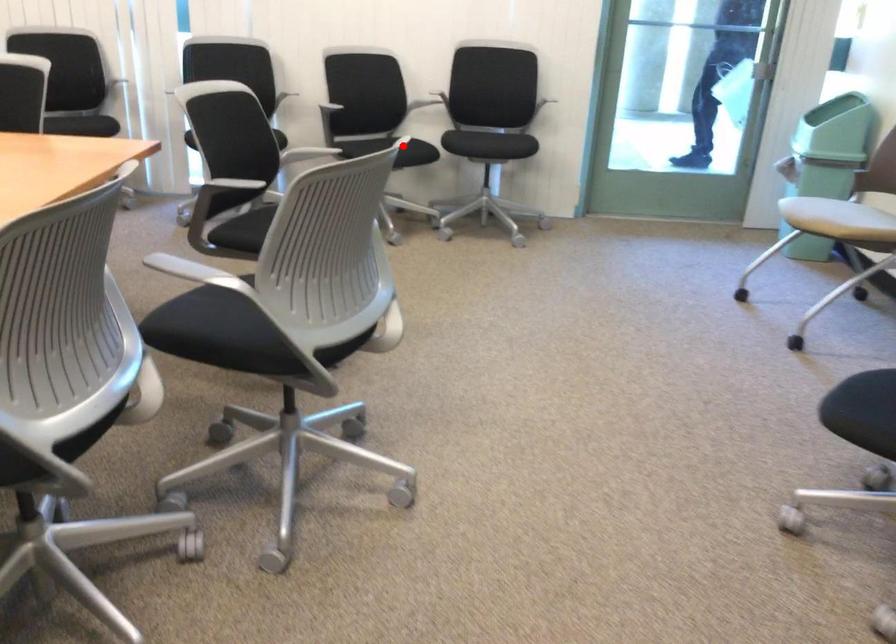
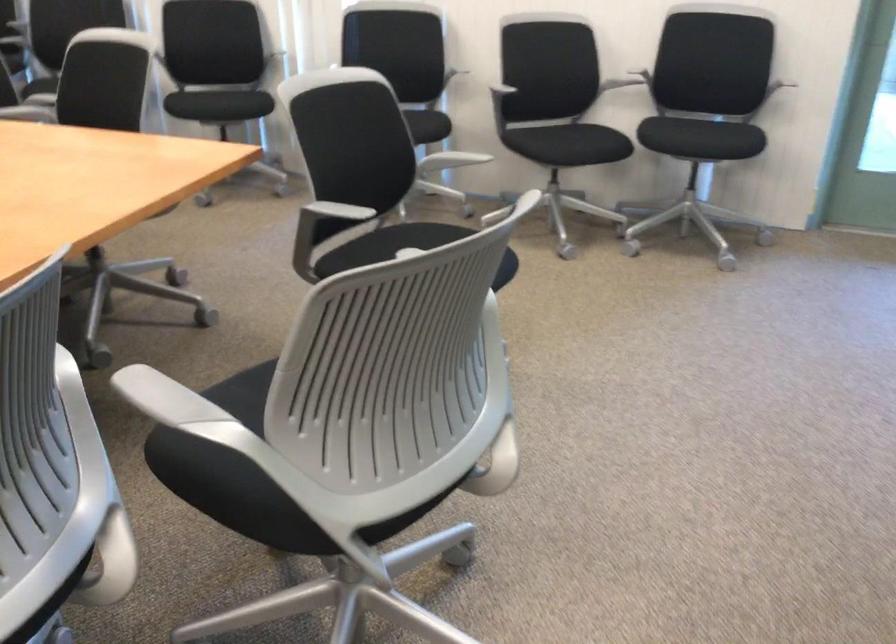
Question: I am providing you with two images of the same scene from different viewpoints. In image1, a red point is highlighted. Considering the same 3D point in image2, which of the following is correct?

Choices:
 (A) It is closer
 (B) It is farther

Answer: (A)